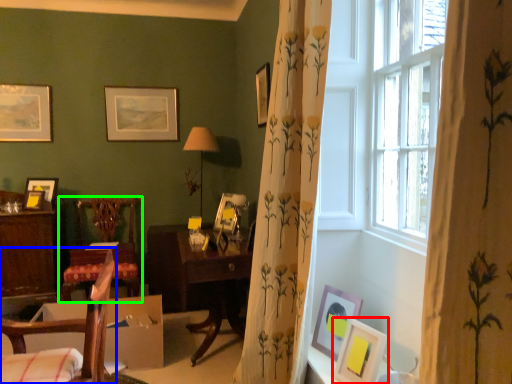
Question: Which is farther away from picture frame (highlighted by a red box)? chair (highlighted by a blue box) or chair (highlighted by a green box)?

Choices:
 (A) chair
 (B) chair

Answer: (B)